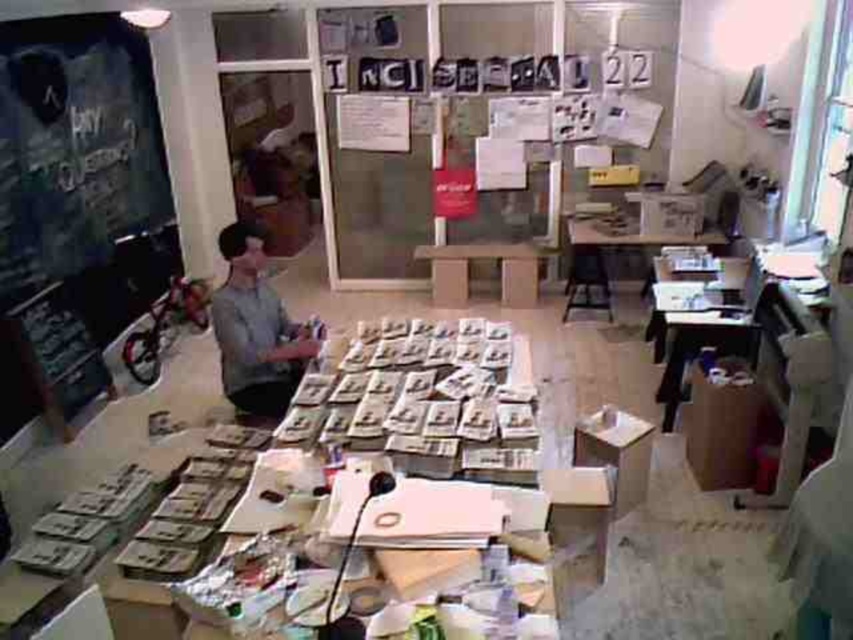
You are organizing the workspace and need to move items from the wooden table at center to the denim fabric bulletin board at left. Which direction should you move the items to place them on the bulletin board?

The denim fabric bulletin board at left is to the left of the wooden table at center, so you should move the items to the left to place them on the bulletin board.

You are organizing the workspace and need to place a new item on the surface. Which object, the gray matte shirt at center or the wooden table at center, is taller and thus might block access to the surface?

The gray matte shirt at center is taller than the wooden table at center, so it might block access to the surface.